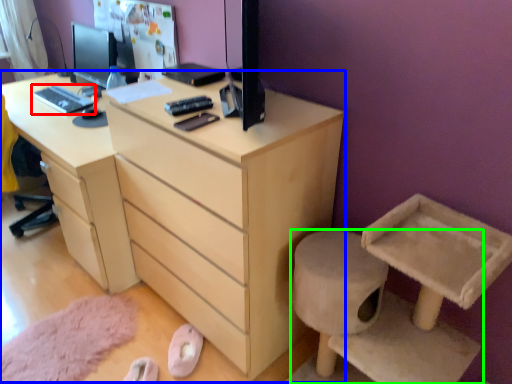
Question: Which object is the closest to the desktop (highlighted by a red box)? Choose among these: chest of drawers (highlighted by a blue box) or furniture (highlighted by a green box).

Choices:
 (A) chest of drawers
 (B) furniture

Answer: (A)